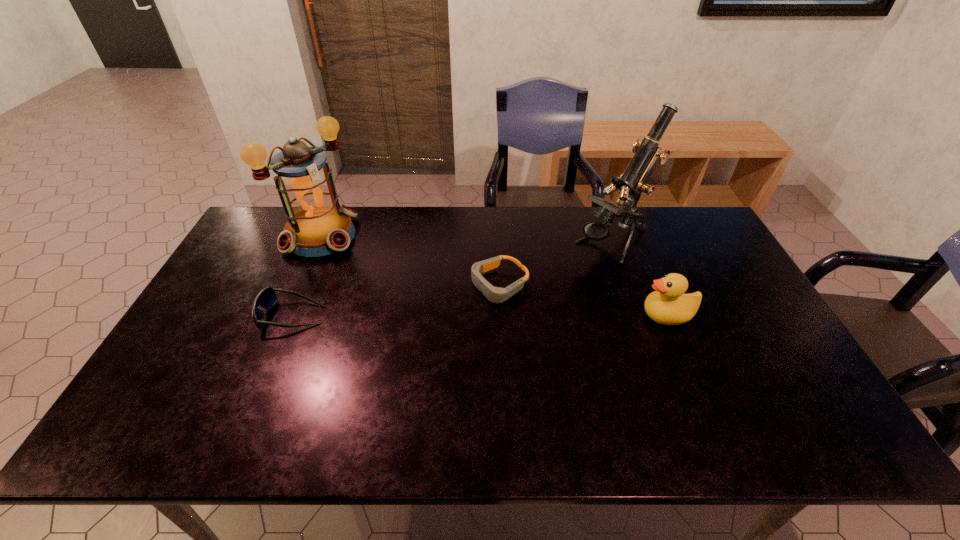
This screenshot has width=960, height=540. What are the coordinates of `free space located 0.150m at the beak of the third shortest object` in the screenshot? It's located at (589, 315).

Where is `vacant space situated 0.300m at the beak of the third shortest object`? vacant space situated 0.300m at the beak of the third shortest object is located at coordinates (536, 315).

I want to click on free region located through the eyepiece of the microscope, so click(495, 318).

Locate an element on the screen. This screenshot has height=540, width=960. free space located 0.150m through the eyepiece of the microscope is located at coordinates (556, 279).

Locate an element on the screen. free space located through the eyepiece of the microscope is located at coordinates (563, 274).

You are a GUI agent. You are given a task and a screenshot of the screen. Output one action in this format:
    pyautogui.click(x=<x>, y=<y>)
    Task: Click on the vacant space located 0.150m on the front-facing side of the fourth shortest object
    This screenshot has height=540, width=960.
    Given the screenshot: What is the action you would take?
    pyautogui.click(x=369, y=271)

Find the location of a particular element. vacant region located 0.330m on the front-facing side of the fourth shortest object is located at coordinates (406, 299).

Locate an element on the screen. This screenshot has height=540, width=960. free point located on the front-facing side of the fourth shortest object is located at coordinates (422, 312).

Locate an element on the screen. This screenshot has width=960, height=540. free space located on the front and back of the shortest object is located at coordinates (425, 320).

Locate an element on the screen. This screenshot has height=540, width=960. vacant space located on the front and back of the shortest object is located at coordinates (406, 329).